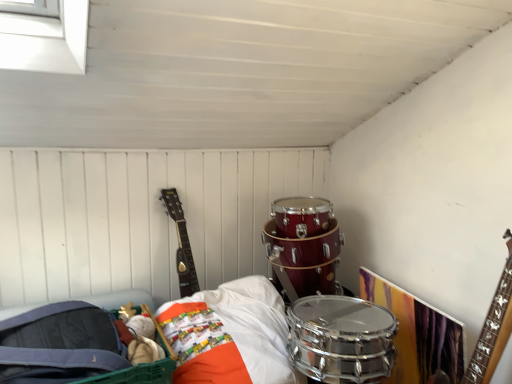
Question: Can you confirm if shiny silver drum at lower center is bigger than matte black guitar at upper left?

Choices:
 (A) no
 (B) yes

Answer: (B)

Question: Is shiny silver drum at lower center shorter than matte black guitar at upper left?

Choices:
 (A) no
 (B) yes

Answer: (B)

Question: Is shiny silver drum at lower center at the left side of matte black guitar at upper left?

Choices:
 (A) yes
 (B) no

Answer: (A)

Question: From a real-world perspective, does shiny silver drum at lower center stand above matte black guitar at upper left?

Choices:
 (A) no
 (B) yes

Answer: (A)

Question: Does shiny silver drum at lower center have a greater width compared to matte black guitar at upper left?

Choices:
 (A) no
 (B) yes

Answer: (B)

Question: Is shiny silver drum at lower center thinner than matte black guitar at upper left?

Choices:
 (A) no
 (B) yes

Answer: (A)

Question: Can we say matte black guitar at upper left lies outside shiny silver drum at lower center?

Choices:
 (A) no
 (B) yes

Answer: (B)

Question: Can shiny silver drum at lower center be found inside matte black guitar at upper left?

Choices:
 (A) yes
 (B) no

Answer: (B)

Question: Considering the relative positions of matte black guitar at upper left and shiny silver drum at lower center in the image provided, is matte black guitar at upper left to the right of shiny silver drum at lower center from the viewer's perspective?

Choices:
 (A) yes
 (B) no

Answer: (A)

Question: Is matte black guitar at upper left behind shiny silver drum at lower center?

Choices:
 (A) yes
 (B) no

Answer: (A)

Question: From a real-world perspective, is matte black guitar at upper left under shiny silver drum at lower center?

Choices:
 (A) no
 (B) yes

Answer: (A)

Question: Considering the relative sizes of matte black guitar at upper left and shiny silver drum at lower center in the image provided, is matte black guitar at upper left shorter than shiny silver drum at lower center?

Choices:
 (A) no
 (B) yes

Answer: (A)

Question: Is matte black guitar at upper left situated inside shiny silver drum at lower center or outside?

Choices:
 (A) inside
 (B) outside

Answer: (B)